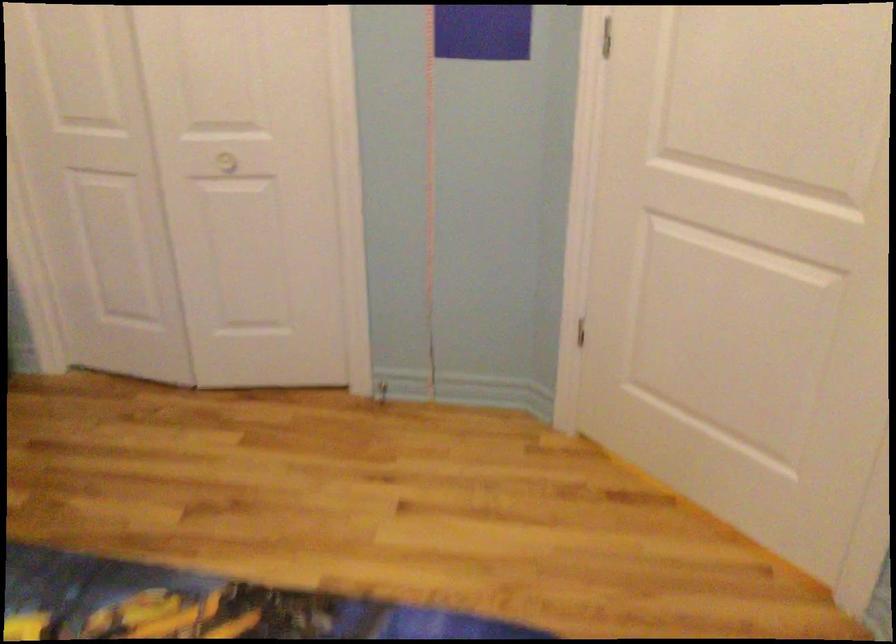
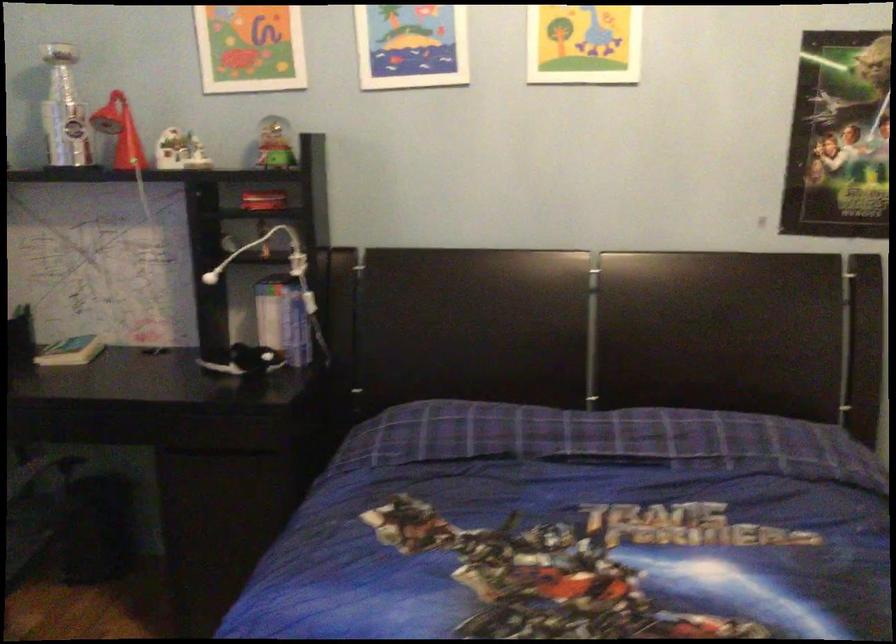
Question: Based on the continuous images, in which direction is the camera rotating? Reply with the corresponding letter.

Choices:
 (A) Left
 (B) Right
 (C) Up
 (D) Down

Answer: (A)